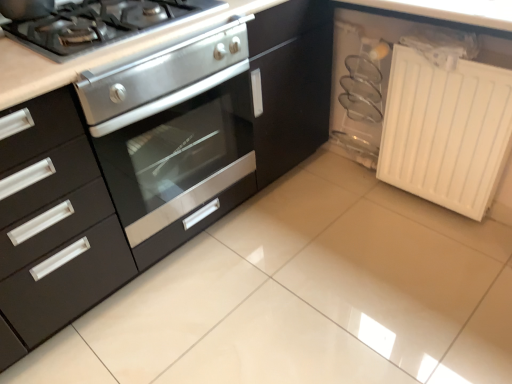
Question: Is white matte radiator at lower right bigger than stainless steel oven at center?

Choices:
 (A) no
 (B) yes

Answer: (A)

Question: Can we say white matte radiator at lower right lies outside stainless steel oven at center?

Choices:
 (A) yes
 (B) no

Answer: (A)

Question: From the image's perspective, is white matte radiator at lower right under stainless steel oven at center?

Choices:
 (A) yes
 (B) no

Answer: (B)

Question: From a real-world perspective, is white matte radiator at lower right on top of stainless steel oven at center?

Choices:
 (A) no
 (B) yes

Answer: (A)

Question: Does white matte radiator at lower right have a lesser height compared to stainless steel oven at center?

Choices:
 (A) yes
 (B) no

Answer: (A)

Question: Considering the positions of stainless steel gas stove at upper left and white matte radiator at lower right in the image, is stainless steel gas stove at upper left taller or shorter than white matte radiator at lower right?

Choices:
 (A) short
 (B) tall

Answer: (A)

Question: In the image, is stainless steel gas stove at upper left positioned in front of or behind white matte radiator at lower right?

Choices:
 (A) front
 (B) behind

Answer: (A)

Question: Would you say stainless steel gas stove at upper left is inside or outside white matte radiator at lower right?

Choices:
 (A) outside
 (B) inside

Answer: (A)

Question: Is stainless steel gas stove at upper left bigger or smaller than white matte radiator at lower right?

Choices:
 (A) big
 (B) small

Answer: (B)

Question: Relative to stainless steel gas stove at upper left, is stainless steel oven at center in front or behind?

Choices:
 (A) front
 (B) behind

Answer: (A)

Question: In the image, is stainless steel oven at center on the left side or the right side of stainless steel gas stove at upper left?

Choices:
 (A) right
 (B) left

Answer: (A)

Question: Is stainless steel oven at center wider or thinner than stainless steel gas stove at upper left?

Choices:
 (A) wide
 (B) thin

Answer: (A)

Question: From a real-world perspective, relative to stainless steel gas stove at upper left, is stainless steel oven at center vertically above or below?

Choices:
 (A) below
 (B) above

Answer: (A)

Question: Considering the positions of point (394, 175) and point (61, 18), is point (394, 175) closer or farther from the camera than point (61, 18)?

Choices:
 (A) farther
 (B) closer

Answer: (A)

Question: Is white matte radiator at lower right inside the boundaries of stainless steel gas stove at upper left, or outside?

Choices:
 (A) inside
 (B) outside

Answer: (B)